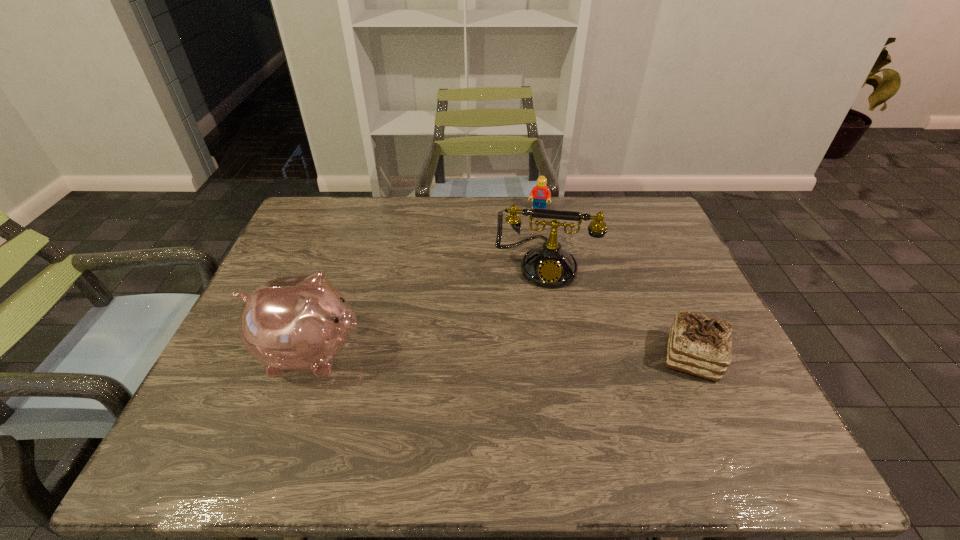
Locate an element on the screen. vacant space on the desktop that is between the leftmost object and the rightmost object and is positioned on the face of the Lego is located at coordinates (508, 355).

Identify the location of vacant spot on the desktop that is between the piggy bank and the chocolate cake and is positioned on the dial of the telephone. This screenshot has width=960, height=540. (540, 355).